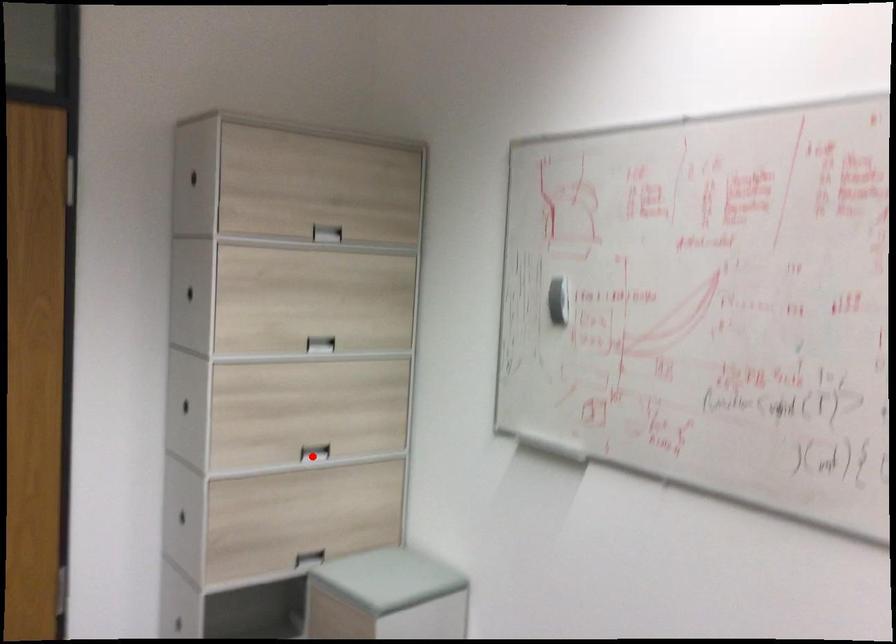
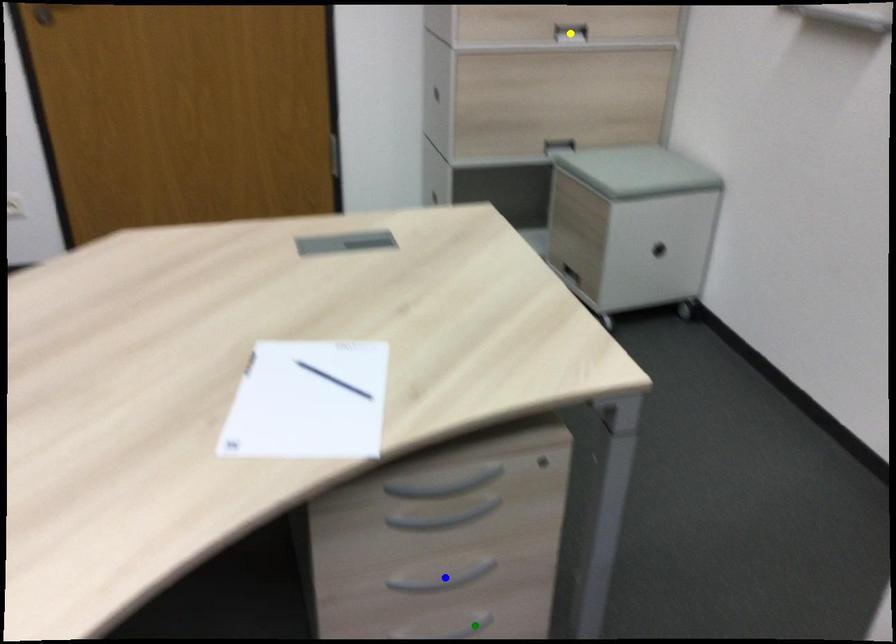
Question: I am providing you with two images of the same scene from different viewpoints. A red point is marked on the first image. You are given multiple points on the second image. Which spot in image 2 lines up with the point in image 1?

Choices:
 (A) green point
 (B) yellow point
 (C) blue point

Answer: (B)